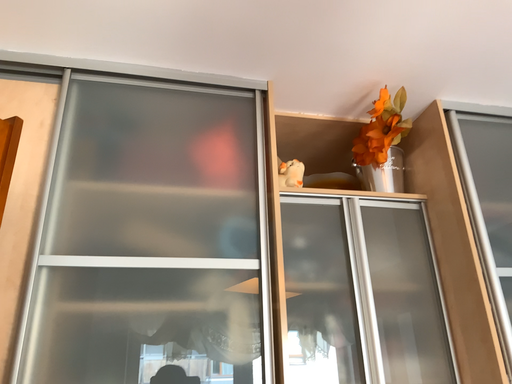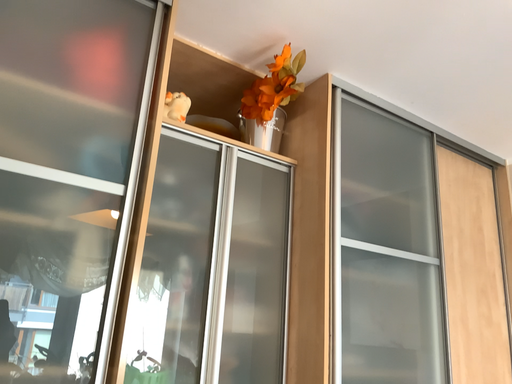
Question: How did the camera likely rotate when shooting the video?

Choices:
 (A) rotated upward
 (B) rotated downward

Answer: (B)